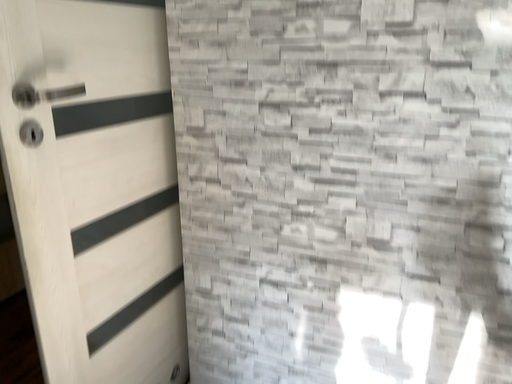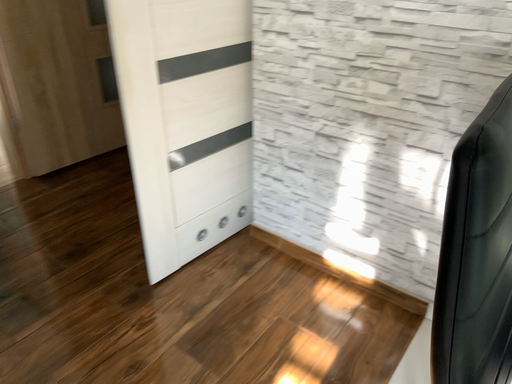
Question: How did the camera likely rotate when shooting the video?

Choices:
 (A) rotated downward
 (B) rotated upward

Answer: (A)